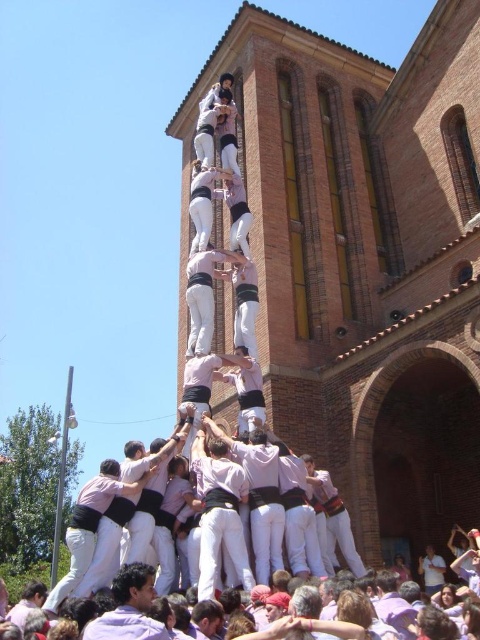
Which is below, pink cotton shirt at center or white cotton shirt at center?

pink cotton shirt at center

Which is more to the left, pink cotton shirt at center or white cotton shirt at center?

From the viewer's perspective, pink cotton shirt at center appears more on the left side.

The image size is (480, 640). What do you see at coordinates (129, 608) in the screenshot?
I see `pink cotton shirt at center` at bounding box center [129, 608].

Find the location of `pink cotton shirt at center`. pink cotton shirt at center is located at coordinates click(x=129, y=608).

Is white cotton crowd at center above pink cotton shirt at center?

Incorrect, white cotton crowd at center is not positioned above pink cotton shirt at center.

Which is behind, point (328, 627) or point (121, 592)?

Positioned behind is point (121, 592).

Locate an element on the screen. white cotton crowd at center is located at coordinates (304, 627).

Which of these two, white cotton crowd at center or white cotton shirt at center, stands shorter?

With less height is white cotton crowd at center.

Is point (272, 637) behind point (193, 253)?

That is False.

The width and height of the screenshot is (480, 640). What do you see at coordinates (304, 627) in the screenshot?
I see `white cotton crowd at center` at bounding box center [304, 627].

What are the coordinates of `white cotton crowd at center` in the screenshot? It's located at (304, 627).